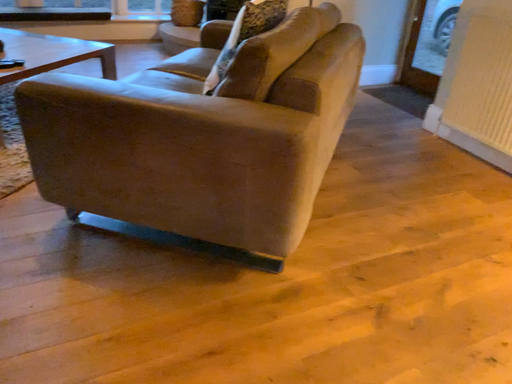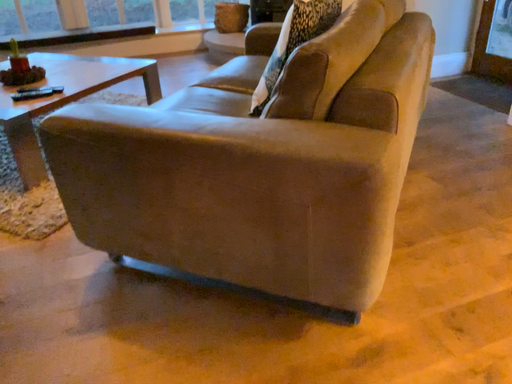
Question: Which way did the camera rotate in the video?

Choices:
 (A) rotated right
 (B) rotated left

Answer: (B)